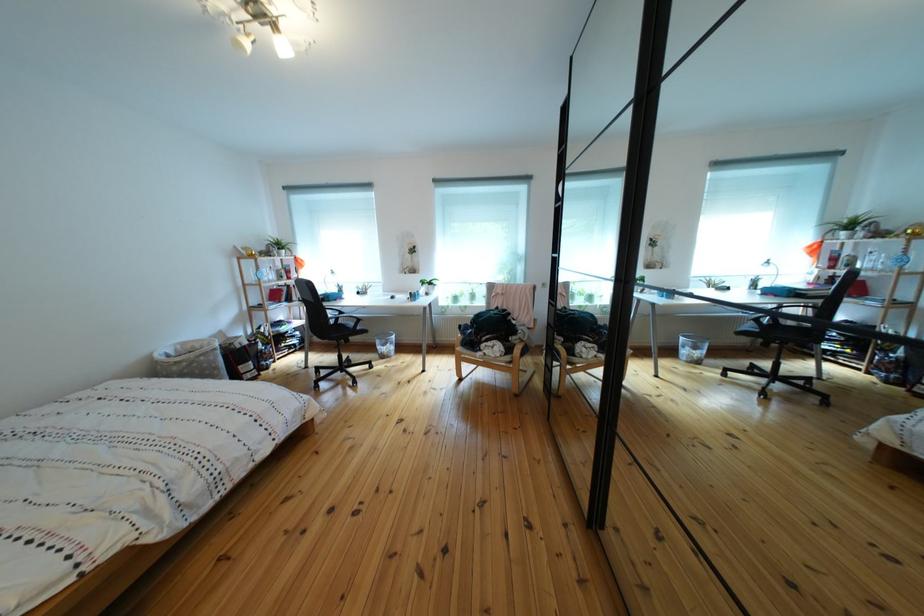
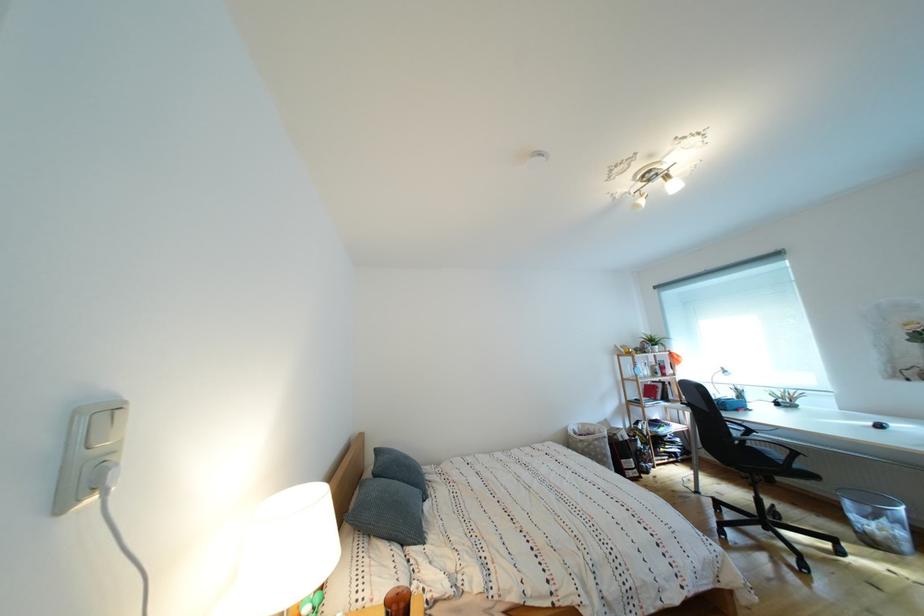
The point at (399,350) is marked in the first image. Where is the corresponding point in the second image?

(896, 527)